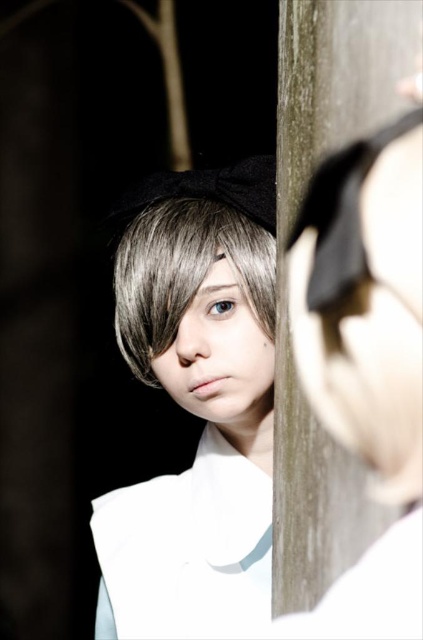
Who is lower down, smooth brown hair at center or matte gray eye at center?

smooth brown hair at center

Looking at this image, which of these two, smooth brown hair at center or matte gray eye at center, stands taller?

Standing taller between the two is smooth brown hair at center.

This screenshot has height=640, width=423. Describe the element at coordinates (184, 273) in the screenshot. I see `smooth brown hair at center` at that location.

At what (x,y) coordinates should I click in order to perform the action: click on smooth brown hair at center. Please return your answer as a coordinate pair (x, y). The width and height of the screenshot is (423, 640). Looking at the image, I should click on (184, 273).

Does smooth white dress at center have a smaller size compared to matte gray eye at center?

Actually, smooth white dress at center might be larger than matte gray eye at center.

Does smooth white dress at center come in front of matte gray eye at center?

Yes, it is.

Image resolution: width=423 pixels, height=640 pixels. What do you see at coordinates (197, 403) in the screenshot?
I see `smooth white dress at center` at bounding box center [197, 403].

Locate an element on the screen. smooth white dress at center is located at coordinates (197, 403).

Who is higher up, smooth white dress at center or smooth brown hair at center?

smooth brown hair at center

Does smooth white dress at center have a greater width compared to smooth brown hair at center?

Indeed, smooth white dress at center has a greater width compared to smooth brown hair at center.

Is point (208, 214) less distant than point (126, 355)?

Yes, point (208, 214) is closer to viewer.

Locate an element on the screen. This screenshot has height=640, width=423. smooth white dress at center is located at coordinates (197, 403).